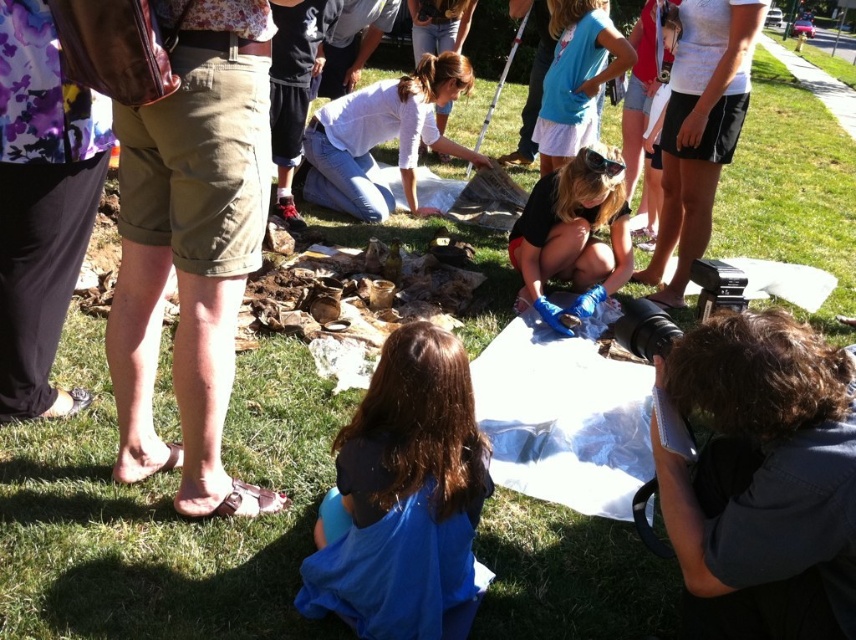
Between dark curly hair at lower right and white cotton shirt at center, which one has less height?

Standing shorter between the two is dark curly hair at lower right.

Which is in front, point (750, 428) or point (476, 152)?

Point (750, 428) is more forward.

Between point (694, 490) and point (407, 186), which one is positioned behind?

Point (407, 186)

Identify the location of dark curly hair at lower right. (762, 480).

Does dark brown hair at lower center appear on the left side of blue latex gloves at center?

Indeed, dark brown hair at lower center is positioned on the left side of blue latex gloves at center.

Which of these two, dark brown hair at lower center or blue latex gloves at center, stands shorter?

dark brown hair at lower center

Find the location of a particular element. dark brown hair at lower center is located at coordinates (405, 499).

Locate an element on the screen. dark brown hair at lower center is located at coordinates (405, 499).

Does white cotton shirt at center appear on the left side of blue latex gloves at center?

Yes, white cotton shirt at center is to the left of blue latex gloves at center.

The image size is (856, 640). Find the location of `white cotton shirt at center`. white cotton shirt at center is located at coordinates (382, 136).